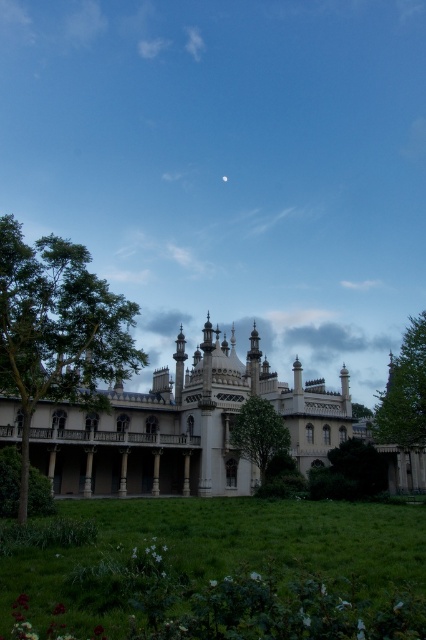
Question: Which is farther from the green leafy tree at left?

Choices:
 (A) green leafy tree at lower center
 (B) green leafy tree at right
 (C) white stone palace at center
 (D) green leafy tree at center

Answer: (B)

Question: Observing the image, what is the correct spatial positioning of green leafy tree at left in reference to green leafy tree at right?

Choices:
 (A) above
 (B) below

Answer: (A)

Question: Is green leafy tree at left below green leafy tree at right?

Choices:
 (A) yes
 (B) no

Answer: (B)

Question: Can you confirm if green leafy tree at center is positioned to the right of green leafy tree at lower center?

Choices:
 (A) no
 (B) yes

Answer: (A)

Question: Which is nearer to the white stone palace at center?

Choices:
 (A) green leafy tree at right
 (B) green leafy tree at left

Answer: (B)

Question: Considering the real-world distances, which object is closest to the green leafy tree at lower center?

Choices:
 (A) green leafy tree at right
 (B) green leafy tree at left

Answer: (A)